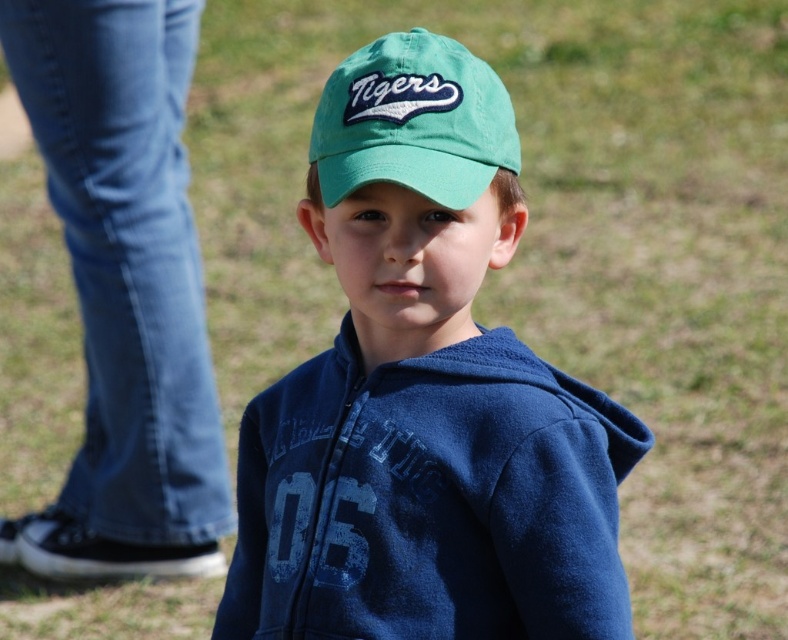
Question: Is green fabric cap at center to the left of green fabric baseball cap at center from the viewer's perspective?

Choices:
 (A) yes
 (B) no

Answer: (B)

Question: Is green fabric cap at center wider than green fabric baseball cap at center?

Choices:
 (A) no
 (B) yes

Answer: (B)

Question: Can you confirm if green fabric cap at center is smaller than green fabric baseball cap at center?

Choices:
 (A) no
 (B) yes

Answer: (A)

Question: Which point is farther to the camera?

Choices:
 (A) green fabric cap at center
 (B) green fabric baseball cap at center

Answer: (B)

Question: Which point is closer to the camera?

Choices:
 (A) green fabric baseball cap at center
 (B) green fabric cap at center

Answer: (B)